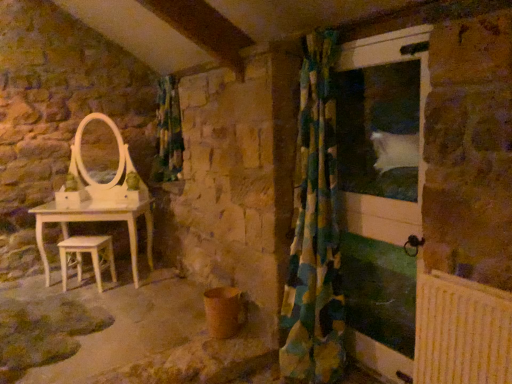
Question: Considering the positions of green-yellow checkered curtain at right and white glossy screen door at right in the image, is green-yellow checkered curtain at right bigger or smaller than white glossy screen door at right?

Choices:
 (A) small
 (B) big

Answer: (B)

Question: Considering their positions, is green-yellow checkered curtain at right located in front of or behind white glossy screen door at right?

Choices:
 (A) front
 (B) behind

Answer: (B)

Question: Estimate the real-world distances between objects in this image. Which object is closer to the light wood stool at lower left?

Choices:
 (A) white glossy screen door at right
 (B) green-yellow checkered curtain at right
 (C) green and blue checkered fabric at center

Answer: (C)

Question: Which is nearer to the green-yellow checkered curtain at right?

Choices:
 (A) light wood stool at lower left
 (B) white glossy screen door at right
 (C) green and blue checkered fabric at center

Answer: (B)